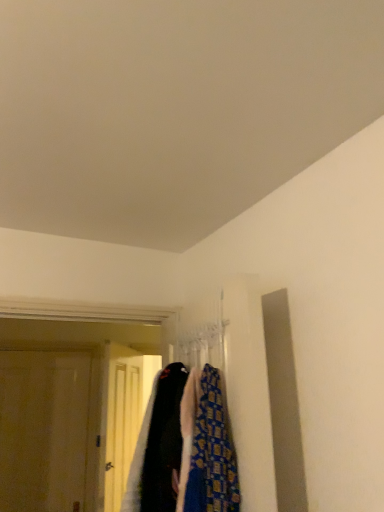
The height and width of the screenshot is (512, 384). What do you see at coordinates (158, 446) in the screenshot?
I see `black fabric cloak at center` at bounding box center [158, 446].

Find the location of a particular element. The width and height of the screenshot is (384, 512). black fabric cloak at center is located at coordinates (158, 446).

Identify the location of black fabric cloak at center. (158, 446).